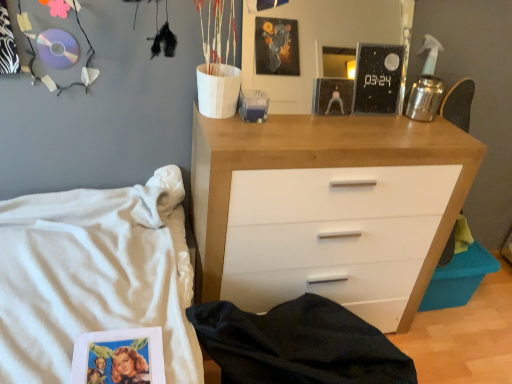
Question: In the image, is white wood chest of drawers at center positioned in front of or behind white cotton bed at lower left?

Choices:
 (A) behind
 (B) front

Answer: (A)

Question: Is white wood chest of drawers at center inside the boundaries of white cotton bed at lower left, or outside?

Choices:
 (A) inside
 (B) outside

Answer: (B)

Question: Considering the real-world distances, which object is farthest from the white cotton bed at lower left?

Choices:
 (A) black glossy clock at upper center
 (B) white wood chest of drawers at center

Answer: (A)

Question: Based on their relative distances, which object is farther from the white wood chest of drawers at center?

Choices:
 (A) white cotton bed at lower left
 (B) black glossy clock at upper center

Answer: (A)